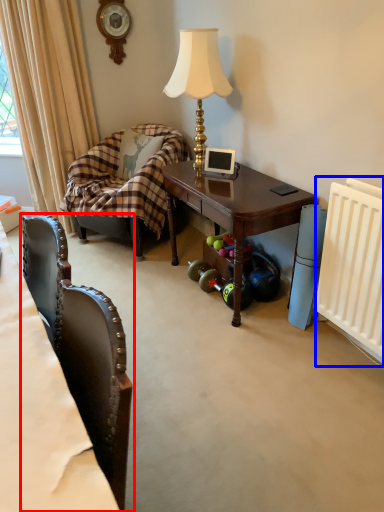
Question: Which object appears farthest to the camera in this image, chair (highlighted by a red box) or radiator (highlighted by a blue box)?

Choices:
 (A) chair
 (B) radiator

Answer: (B)